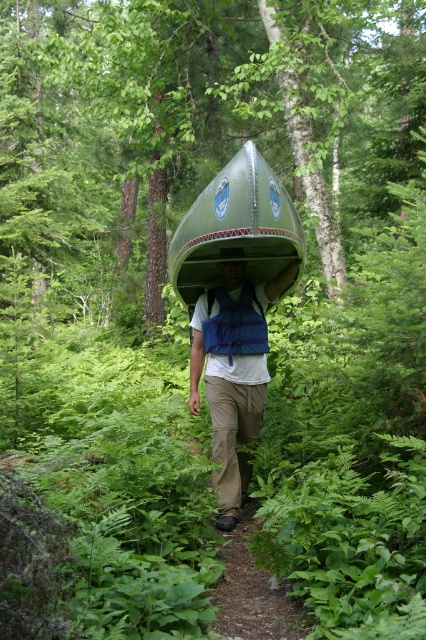
Between point (241, 444) and point (252, 285), which one is positioned in front?

Point (241, 444)

Is khaki cotton pants at center in front of blue fabric strap at center?

Yes, khaki cotton pants at center is closer to the viewer.

Which is behind, point (221, 490) or point (255, 296)?

The point (255, 296) is behind.

Locate an element on the screen. khaki cotton pants at center is located at coordinates (233, 436).

Between point (236, 458) and point (244, 260), which one is positioned behind?

The point (244, 260) is behind.

Can you confirm if khaki cotton pants at center is wider than matte blue helmet at center?

Correct, the width of khaki cotton pants at center exceeds that of matte blue helmet at center.

Between point (215, 417) and point (221, 278), which one is positioned in front?

Point (215, 417) is more forward.

Where is `khaki cotton pants at center`? khaki cotton pants at center is located at coordinates (233, 436).

Consider the image. Can you confirm if matte green canoe at center is shorter than blue fabric strap at center?

In fact, matte green canoe at center may be taller than blue fabric strap at center.

Is point (221, 380) positioned in front of point (207, 291)?

Yes, it is.

This screenshot has height=640, width=426. I want to click on matte green canoe at center, so click(x=233, y=378).